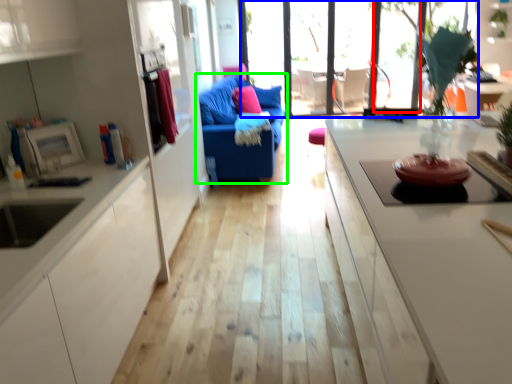
Question: Which is nearer to the window (highlighted by a red box)? window (highlighted by a blue box) or studio couch (highlighted by a green box).

Choices:
 (A) window
 (B) studio couch

Answer: (A)